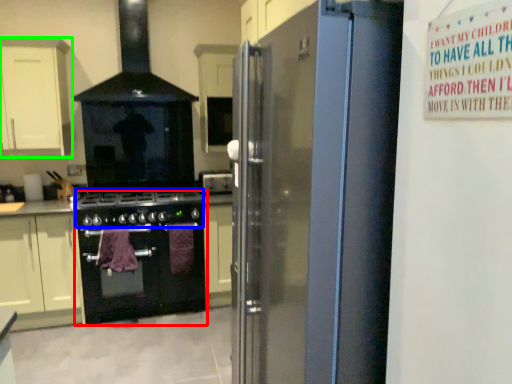
Question: Considering the real-world distances, which object is farthest from kitchen appliance (highlighted by a red box)? gas stove (highlighted by a blue box) or cabinetry (highlighted by a green box)?

Choices:
 (A) gas stove
 (B) cabinetry

Answer: (B)